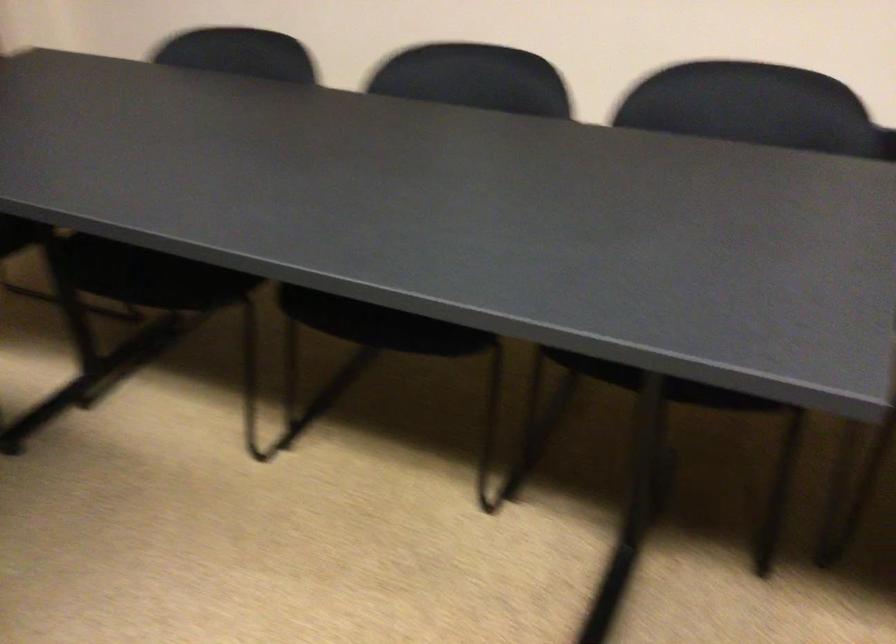
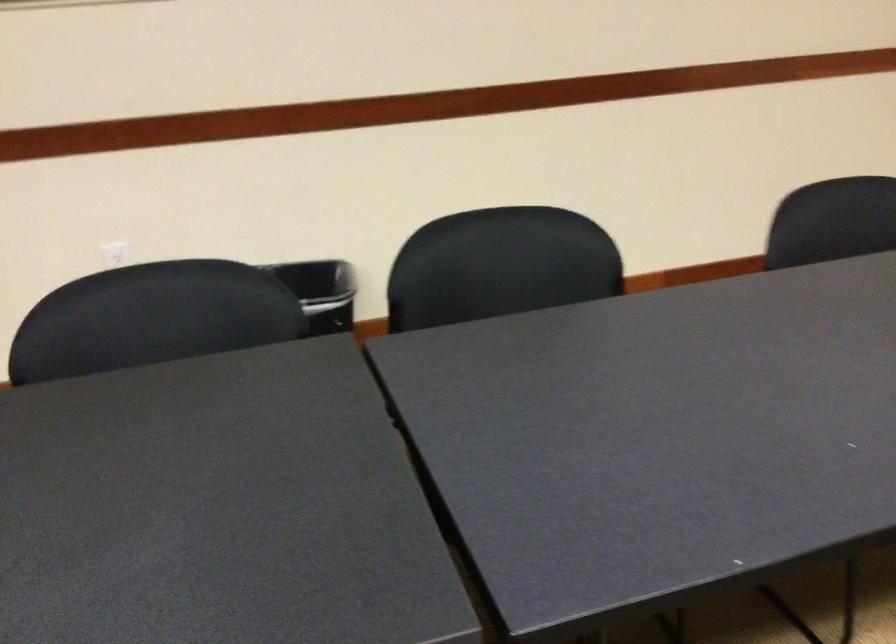
Question: How did the camera likely rotate?

Choices:
 (A) Left
 (B) Right
 (C) Up
 (D) Down

Answer: (B)